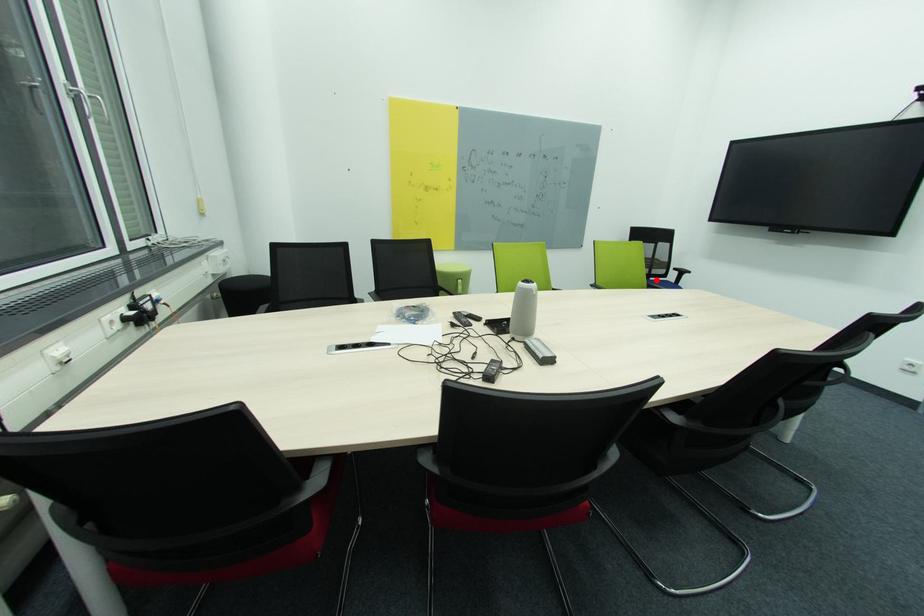
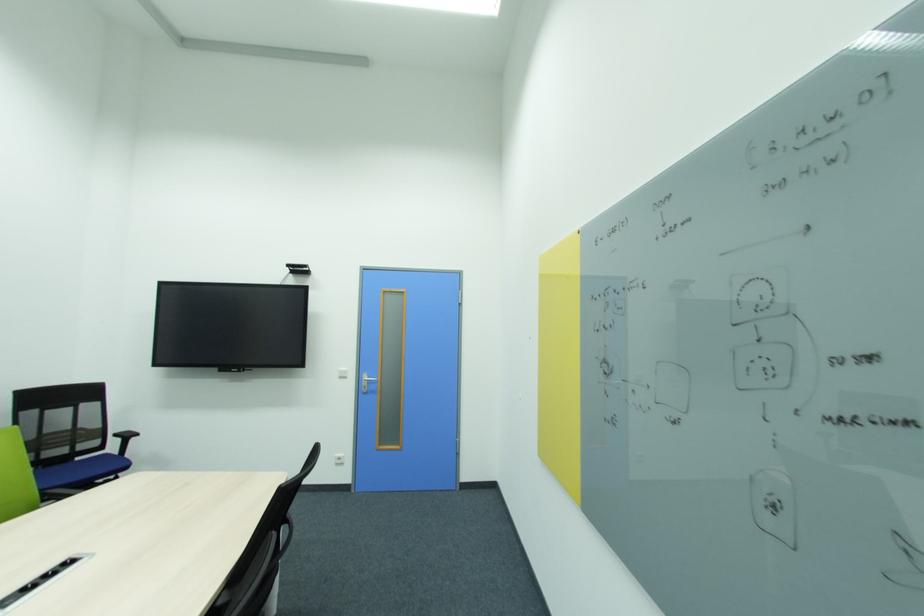
The point at the highlighted location is marked in the first image. Where is the corresponding point in the second image?

(82, 460)